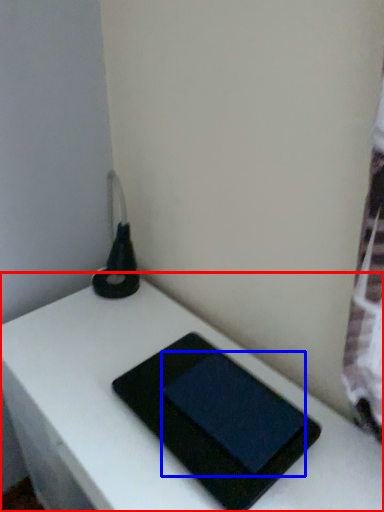
Question: Which object is closer to the camera taking this photo, table (highlighted by a red box) or tablet computer (highlighted by a blue box)?

Choices:
 (A) table
 (B) tablet computer

Answer: (A)